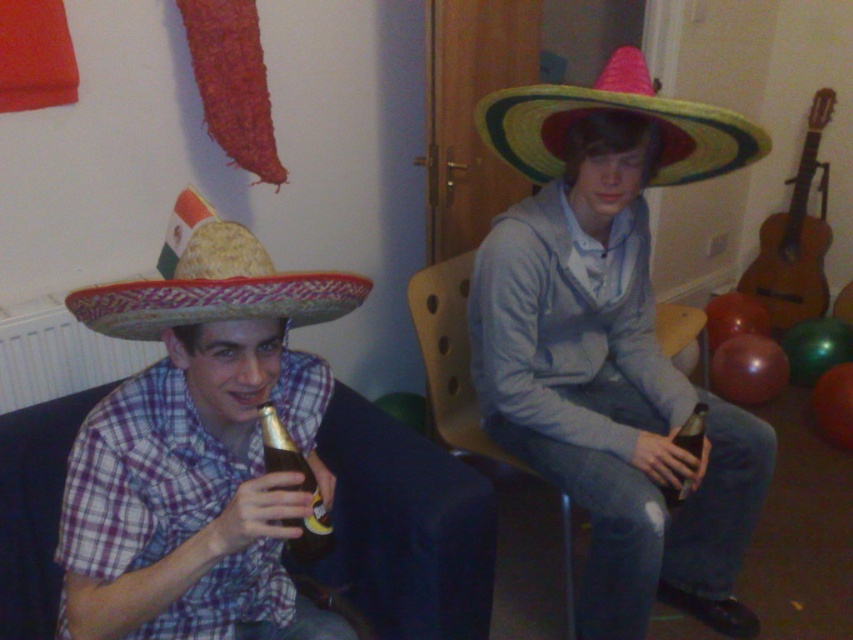
In the scene shown: You are standing in the room and want to move towards the two points marked in the image. Which point, point (323, 304) or point (463, 340), will you reach first?

Point (323, 304) is closer to the viewer than point (463, 340), so you will reach point (323, 304) first.

You are a photographer setting up a shoot in the room. You need to position a light source so that it illuminates the plaid fabric shirt at left without shining directly on the wooden chair at center. Based on their positions, is this possible?

The plaid fabric shirt at left is located above the wooden chair at center, so placing the light source above the shirt would cast light downward onto it while avoiding direct shine on the chair below.

You are a photographer setting up for a group photo. You want to ensure that both the matte gray hoodie at center and the multicolored straw sombrero at upper right are clearly visible in the shot. Based on their positions, which object is closer to the camera?

The matte gray hoodie at center is closer to the camera because the multicolored straw sombrero at upper right is positioned behind it.